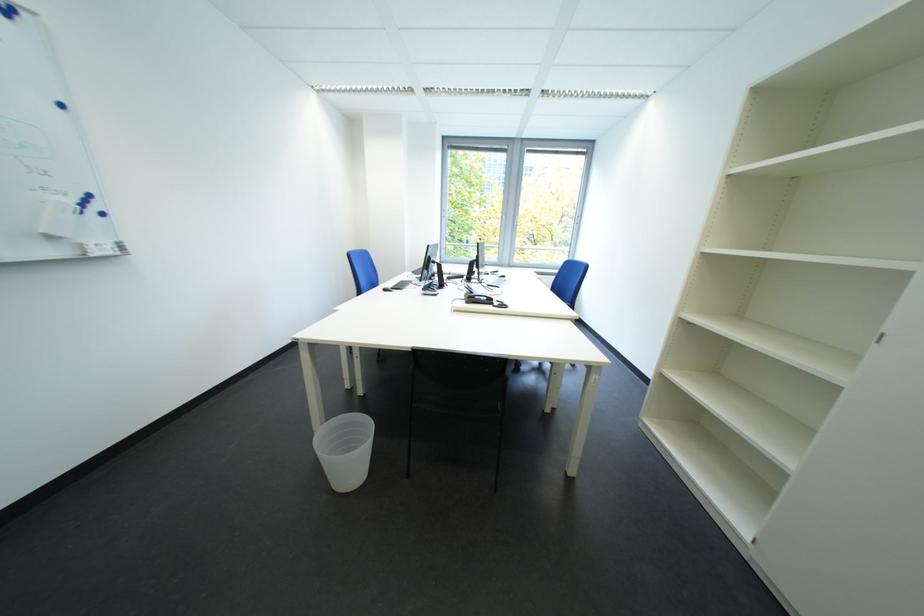
Where would you lift the phone handset? Please return your answer as a coordinate pair (x, y).

(478, 299)